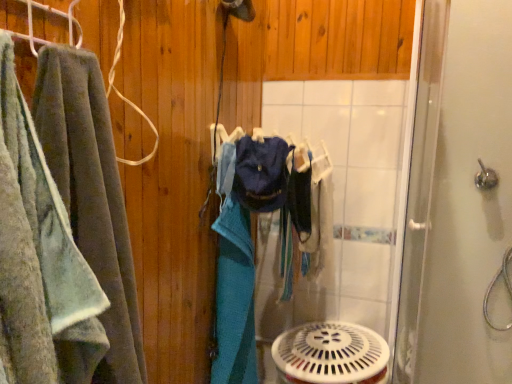
Question: From a real-world perspective, is soft green towel at left positioned above or below silver metallic shower handle at upper right?

Choices:
 (A) below
 (B) above

Answer: (A)

Question: Would you say soft green towel at left is to the left or to the right of silver metallic shower handle at upper right in the picture?

Choices:
 (A) right
 (B) left

Answer: (B)

Question: Considering the real-world distances, which object is farthest from the white plastic mechanical fan at lower center?

Choices:
 (A) silver metallic shower handle at upper right
 (B) clear glass shower door at right
 (C) soft green towel at left

Answer: (C)

Question: Considering the real-world distances, which object is closest to the clear glass shower door at right?

Choices:
 (A) soft green towel at left
 (B) white plastic mechanical fan at lower center
 (C) silver metallic shower handle at upper right

Answer: (C)